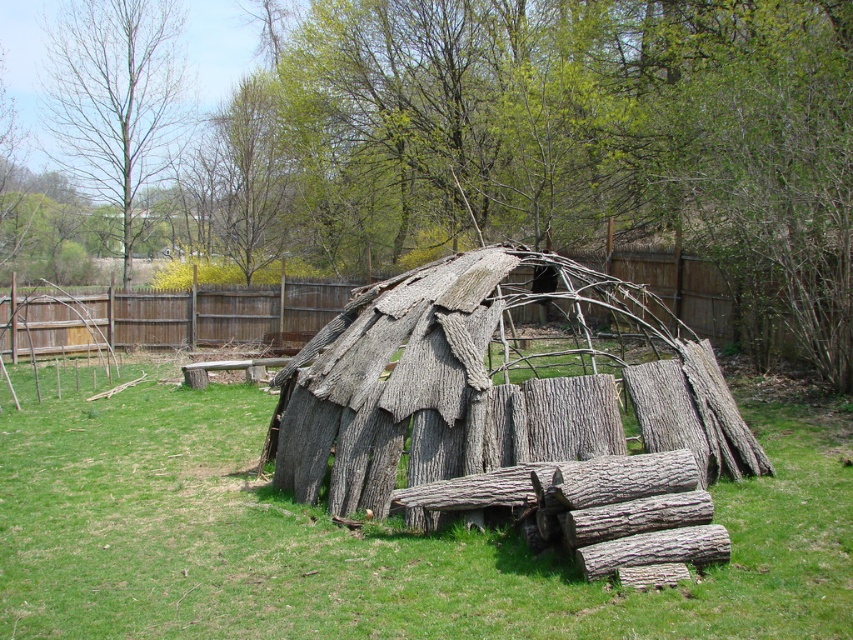
You are planning to set up a small tent in the scene described. Given that the tent requires a space larger than the gray bark hut at center, can the green grass at center accommodate it?

The green grass at center is larger in size than the gray bark hut at center, so it can accommodate the tent requiring space larger than the gray bark hut at center.

You are a gardener planning to mow the green grass at center and the wooden fence at upper center. Which area requires a wider path for the mower?

The wooden fence at upper center requires a wider path for the mower because it has a greater width than the green grass at center.

You are standing at the point labeled point (x=102, y=179) and want to walk towards the shelter. Is the point labeled point (x=747, y=552) in your path?

Yes, the point labeled point (x=747, y=552) is in your path because it is in front of point (x=102, y=179), which is your current position.